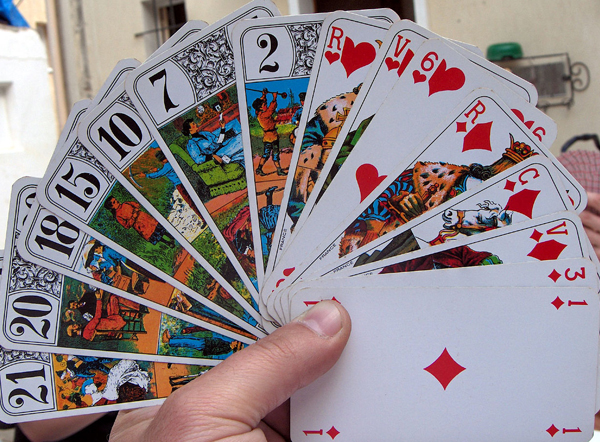
Find the location of a particular element. window is located at coordinates (166, 17).